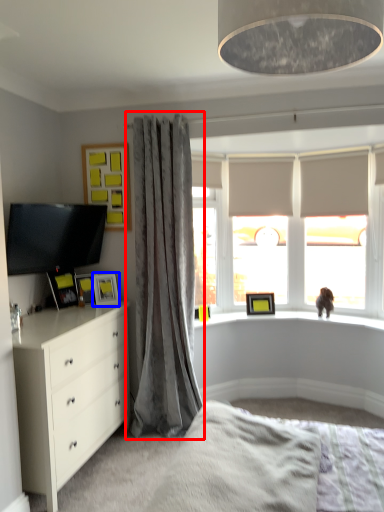
Question: Which object appears closest to the camera in this image, curtain (highlighted by a red box) or picture frame (highlighted by a blue box)?

Choices:
 (A) curtain
 (B) picture frame

Answer: (A)